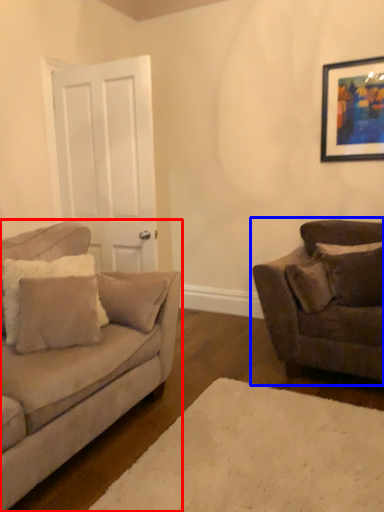
Question: Among these objects, which one is farthest to the camera, studio couch (highlighted by a red box) or studio couch (highlighted by a blue box)?

Choices:
 (A) studio couch
 (B) studio couch

Answer: (B)